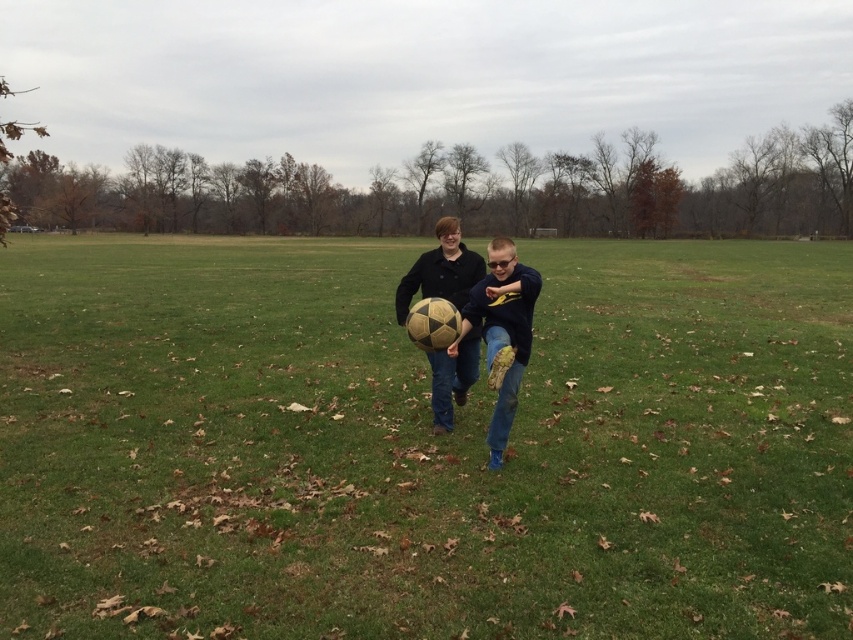
Can you confirm if green grass at center is positioned below matte gold soccer ball at center?

Actually, green grass at center is above matte gold soccer ball at center.

Does green grass at center have a larger size compared to matte gold soccer ball at center?

Correct, green grass at center is larger in size than matte gold soccer ball at center.

What do you see at coordinates (421, 445) in the screenshot?
I see `green grass at center` at bounding box center [421, 445].

In order to click on green grass at center in this screenshot , I will do `click(421, 445)`.

Does matte yellow soccer ball at center lie in front of matte gold soccer ball at center?

That is True.

Does matte yellow soccer ball at center have a greater width compared to matte gold soccer ball at center?

Indeed, matte yellow soccer ball at center has a greater width compared to matte gold soccer ball at center.

Measure the distance between point (x=508, y=426) and camera.

The distance of point (x=508, y=426) from camera is 5.08 meters.

You are a GUI agent. You are given a task and a screenshot of the screen. Output one action in this format:
    pyautogui.click(x=<x>, y=<y>)
    Task: Click on the matte yellow soccer ball at center
    This screenshot has height=640, width=853.
    Given the screenshot: What is the action you would take?
    pyautogui.click(x=502, y=333)

Does green grass at center have a greater height compared to matte yellow soccer ball at center?

Yes, green grass at center is taller than matte yellow soccer ball at center.

Does green grass at center have a larger size compared to matte yellow soccer ball at center?

Correct, green grass at center is larger in size than matte yellow soccer ball at center.

Where is `green grass at center`? The width and height of the screenshot is (853, 640). green grass at center is located at coordinates (421, 445).